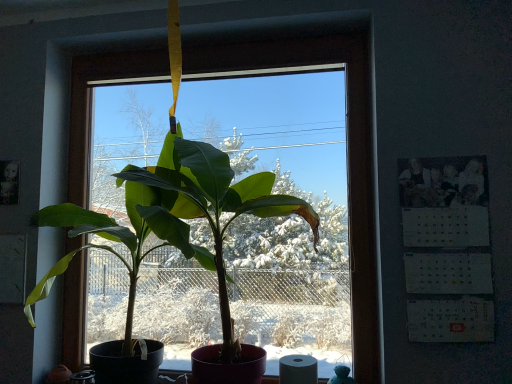
Question: Should I look upward or downward to see green matte plant at center?

Choices:
 (A) up
 (B) down

Answer: (B)

Question: Is green matte plant at center not close to white paper calendar at right?

Choices:
 (A) yes
 (B) no

Answer: (B)

Question: Is green matte plant at center closer to camera compared to white paper calendar at right?

Choices:
 (A) yes
 (B) no

Answer: (A)

Question: Does green matte plant at center have a lesser height compared to white paper calendar at right?

Choices:
 (A) yes
 (B) no

Answer: (B)

Question: From the image's perspective, is green matte plant at center under white paper calendar at right?

Choices:
 (A) no
 (B) yes

Answer: (B)

Question: Is green matte plant at center wider than white paper calendar at right?

Choices:
 (A) yes
 (B) no

Answer: (A)

Question: Is green matte plant at center completely or partially outside of white paper calendar at right?

Choices:
 (A) no
 (B) yes

Answer: (B)

Question: Considering the relative sizes of green matte plant at center and white matte toilet paper at lower center in the image provided, is green matte plant at center taller than white matte toilet paper at lower center?

Choices:
 (A) yes
 (B) no

Answer: (A)

Question: Is green matte plant at center beside white matte toilet paper at lower center?

Choices:
 (A) yes
 (B) no

Answer: (B)

Question: Does green matte plant at center have a smaller size compared to white matte toilet paper at lower center?

Choices:
 (A) yes
 (B) no

Answer: (B)

Question: Is green matte plant at center bigger than white matte toilet paper at lower center?

Choices:
 (A) no
 (B) yes

Answer: (B)

Question: Is green matte plant at center positioned far away from white matte toilet paper at lower center?

Choices:
 (A) yes
 (B) no

Answer: (B)

Question: From a real-world perspective, is green matte plant at center located higher than white matte toilet paper at lower center?

Choices:
 (A) no
 (B) yes

Answer: (B)

Question: Considering the relative sizes of white paper calendar at right and white matte toilet paper at lower center in the image provided, is white paper calendar at right smaller than white matte toilet paper at lower center?

Choices:
 (A) no
 (B) yes

Answer: (A)